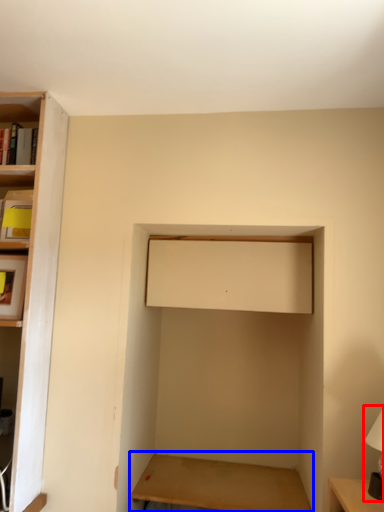
Question: Which object appears farthest to the camera in this image, table lamp (highlighted by a red box) or table (highlighted by a blue box)?

Choices:
 (A) table lamp
 (B) table

Answer: (B)